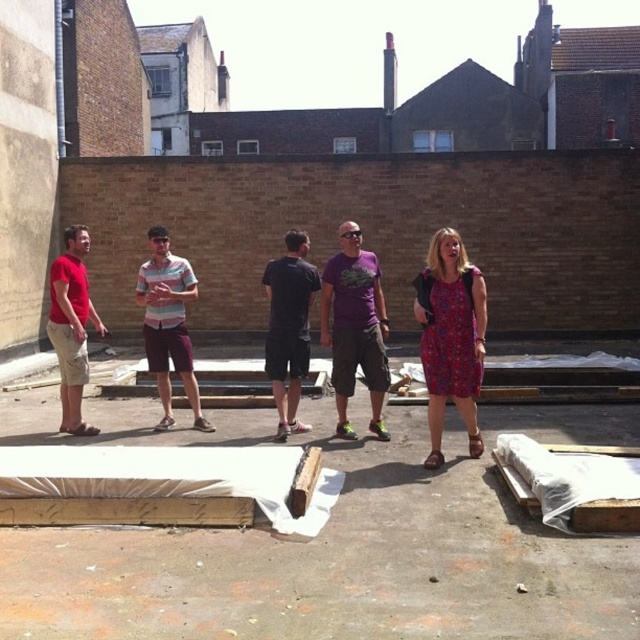
You are standing at the camera position and want to throw a ball to the person wearing the striped cotton shirt at center. The ball has a maximum throw distance of 7 meters. Will you be able to reach them?

The striped cotton shirt at center is 7.17 meters away from the camera, which exceeds the ball throw distance of 7 meters. Therefore, you cannot reach them with the ball.